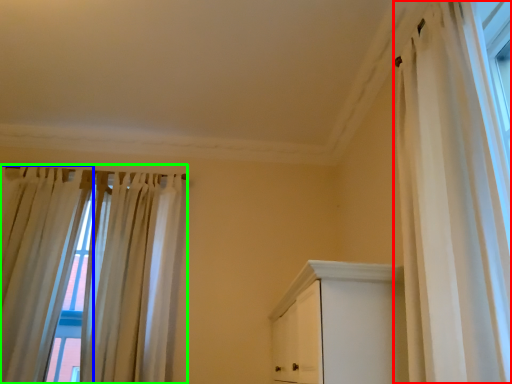
Question: Considering the real-world distances, which object is closest to curtain (highlighted by a red box)? curtain (highlighted by a blue box) or curtain (highlighted by a green box).

Choices:
 (A) curtain
 (B) curtain

Answer: (B)